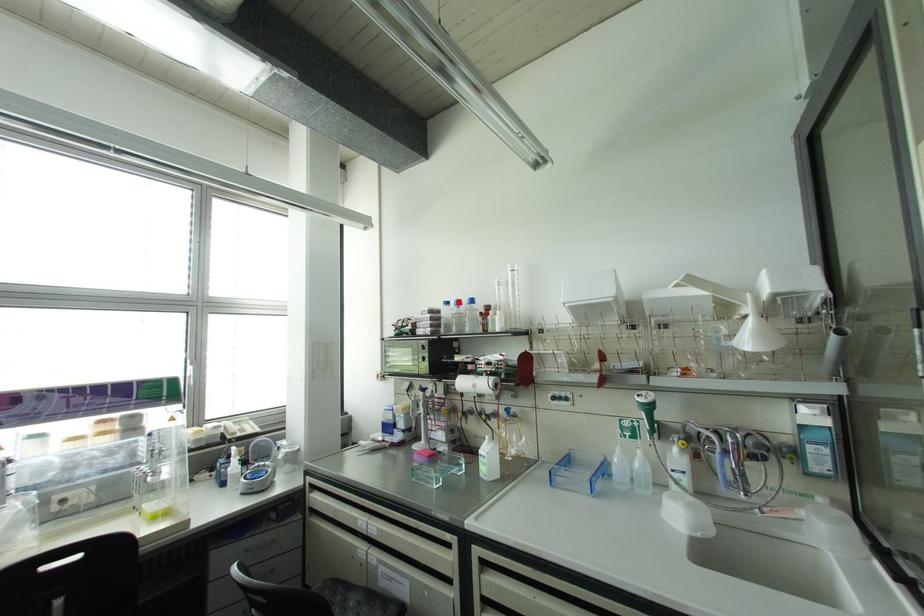
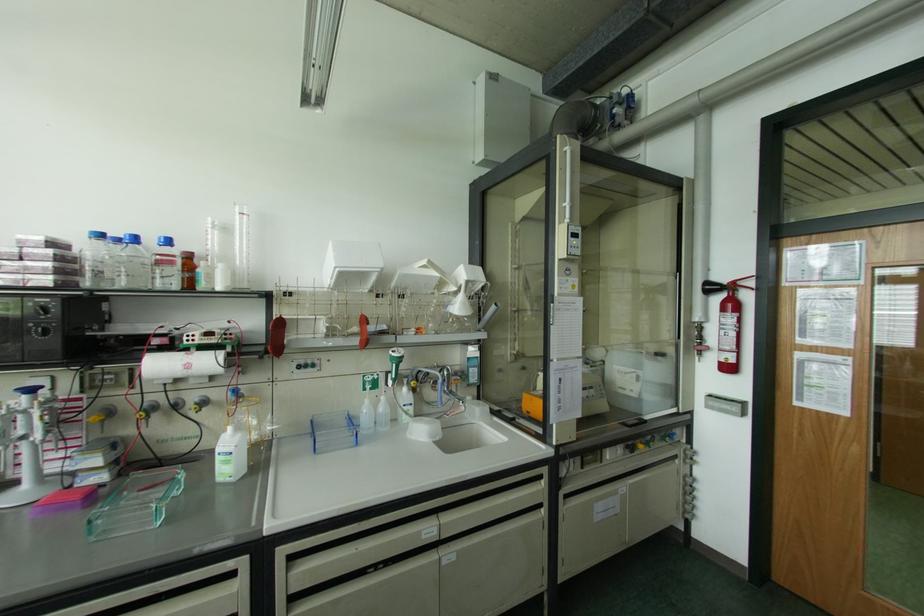
In the second image, find the point that corresponds to the highlighted location in the first image.

(134, 238)